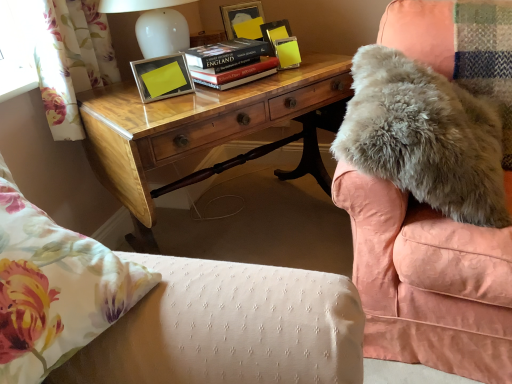
Find the location of a particular element. The width and height of the screenshot is (512, 384). spots to the right of hardcover book at center is located at coordinates (296, 74).